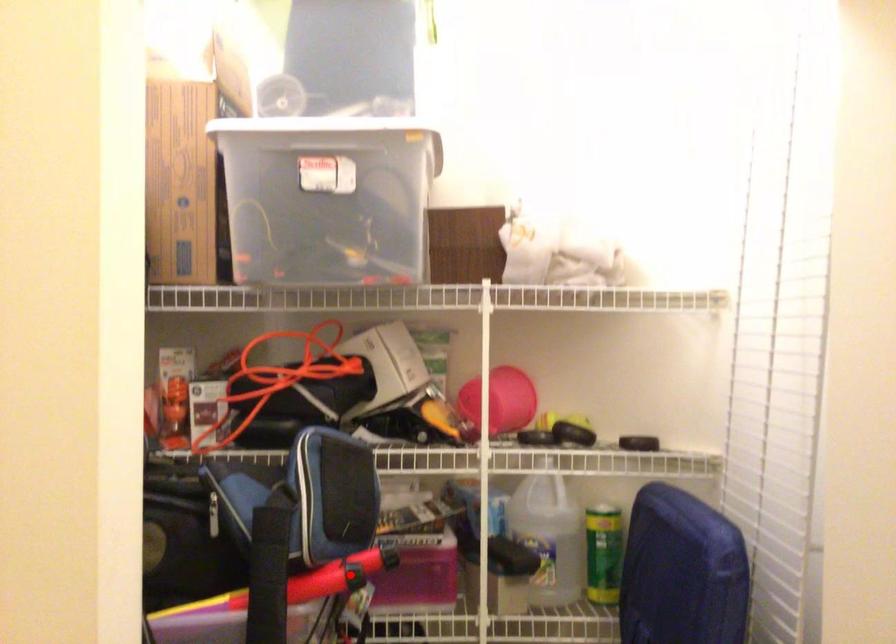
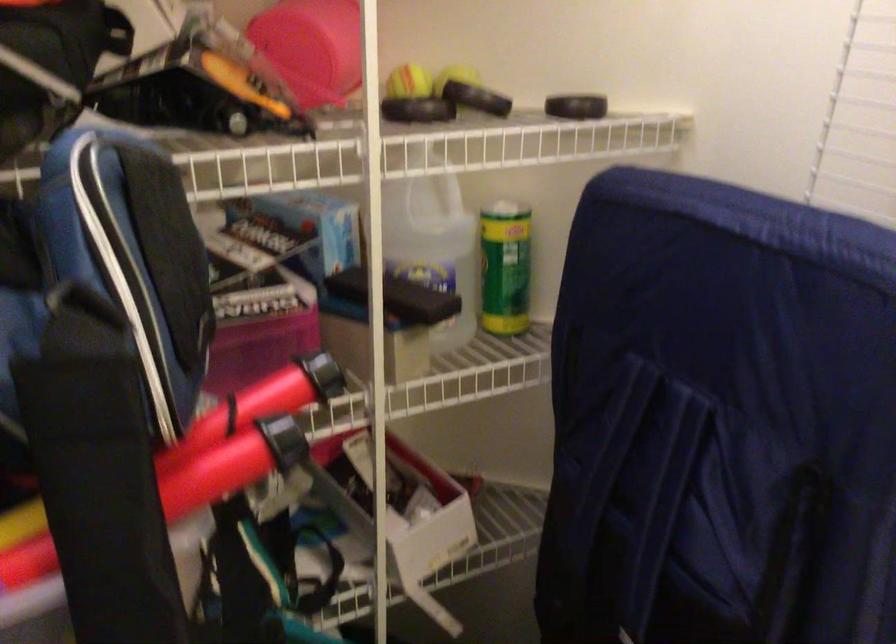
Where in the second image is the point corresponding to the highlighted location from the first image?

(282, 440)